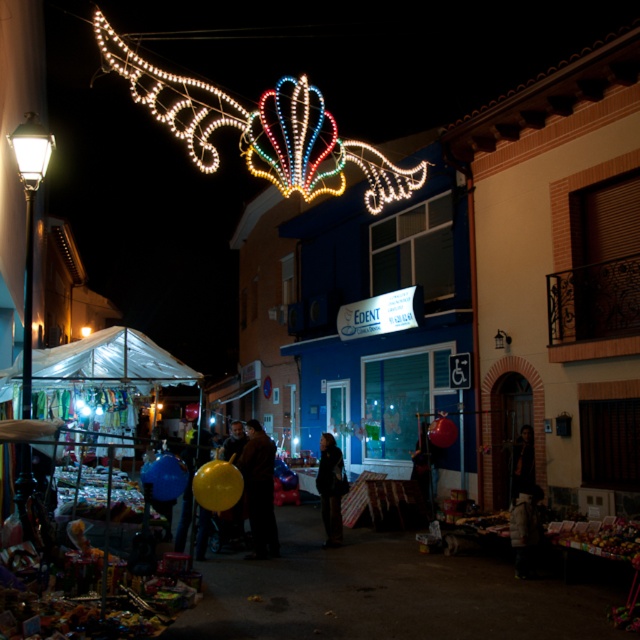
You are a customer at the market stall under the transparent plastic canopy at lower left. You want to move to the white glass streetlight at left to take a closer look. Which direction should you walk?

The transparent plastic canopy at lower left is positioned under the white glass streetlight at left, so you should walk forward towards the white glass streetlight at left since it is directly above the canopy.